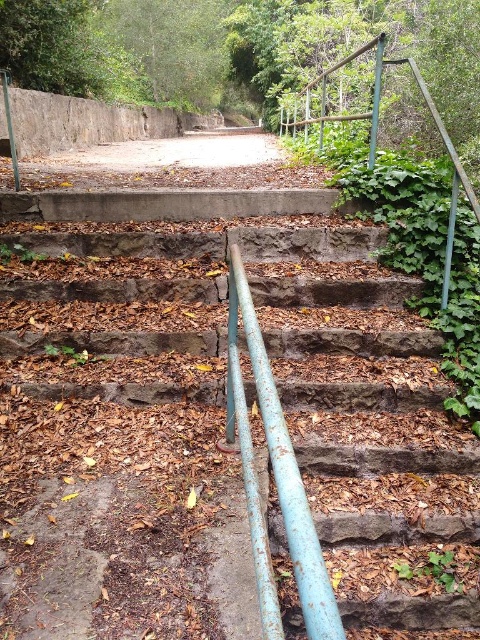
You are standing at the bottom of the stone steps and want to take a photo of the rusty metal railing at center. If your camera is 5.64 feet away from the railing, is it within the camera lens focal length of 5 feet?

The camera is 5.64 feet away from the rusty metal railing at center, which is beyond the 5 feet focal length. Therefore, the camera is too far to capture the railing clearly within the 5 feet focal length range.

You are standing at the bottom of the stone steps and want to reach the paved pathway at the top. There are two points marked on the steps, point [108,202] and point [423,88]. Which point is closer to you as you start climbing the steps?

Point [108,202] is closer to you because it is further to the viewer than point [423,88], meaning it is physically nearer to your starting position at the bottom of the steps.